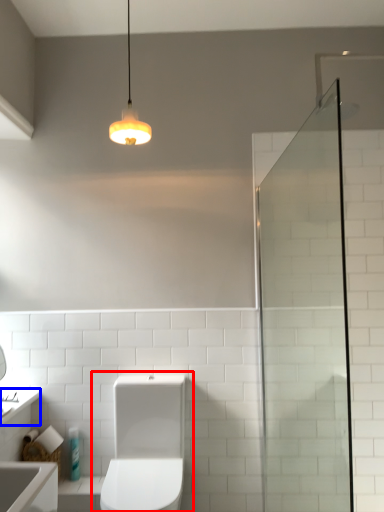
Question: Which object appears closest to the camera in this image, toilet (highlighted by a red box) or counter top (highlighted by a blue box)?

Choices:
 (A) toilet
 (B) counter top

Answer: (A)